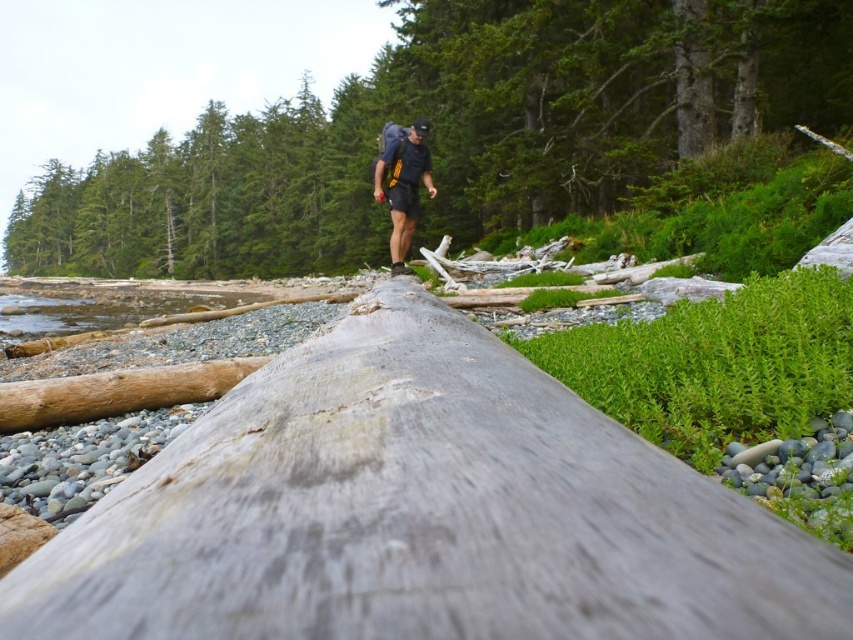
Question: Is the position of weathered gray log at center less distant than that of smooth gray log at center?

Choices:
 (A) yes
 (B) no

Answer: (A)

Question: In this image, where is weathered gray log at center located relative to smooth gray log at center?

Choices:
 (A) right
 (B) left

Answer: (A)

Question: Which of the following is the closest to the observer?

Choices:
 (A) (383, 605)
 (B) (402, 172)

Answer: (A)

Question: Which object appears closest to the camera in this image?

Choices:
 (A) matte black backpack at center
 (B) smooth gray log at center

Answer: (A)

Question: Estimate the real-world distances between objects in this image. Which object is farther from the matte black backpack at center?

Choices:
 (A) weathered gray log at center
 (B) smooth gray log at center

Answer: (B)

Question: Can you confirm if weathered gray log at center is positioned to the right of smooth gray log at center?

Choices:
 (A) yes
 (B) no

Answer: (A)